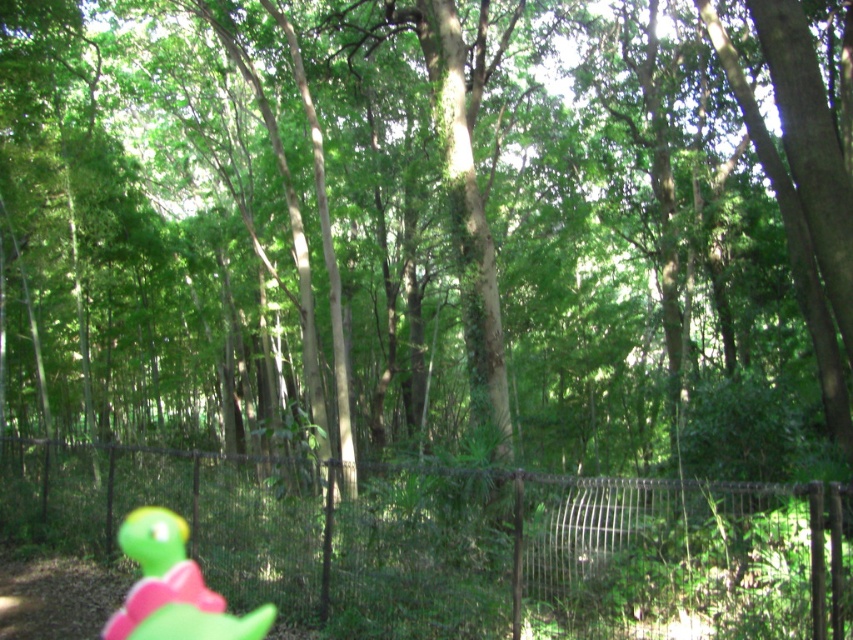
You are a hiker navigating through the forest and want to reach a specific point. You have two options marked as point coordinates on your map. Which point is closer to you, point (692, 531) or point (262, 637)?

Point (692, 531) is closer to you because it is further to the viewer than point (262, 637).

You are a painter standing in the forest scene. You want to paint the black metal fence at center and the green rubber turtle at lower left. Which object should you move closer to if you want to paint more details of the fence without moving the turtle?

You should move closer to the black metal fence at center because its width is larger than the green rubber turtle at lower left, allowing you to capture more details by being nearer to it.